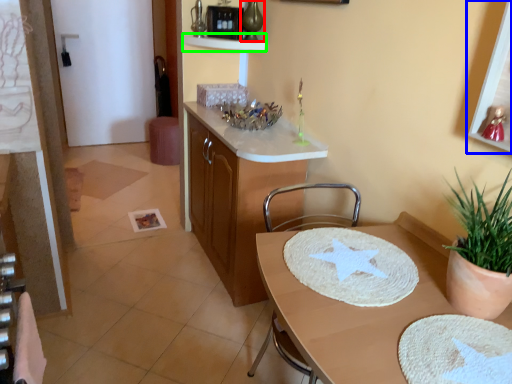
Question: Considering the real-world distances, which object is closest to vase (highlighted by a red box)? picture frame (highlighted by a blue box) or shelf (highlighted by a green box).

Choices:
 (A) picture frame
 (B) shelf

Answer: (B)